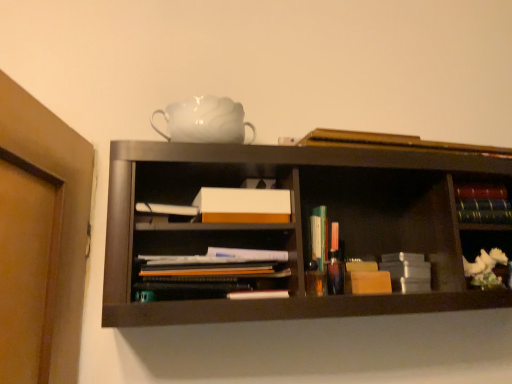
Question: Would you say white ceramic flower at right is to the left or to the right of hardcover books at right, positioned as the 3th book in top-to-bottom order, in the picture?

Choices:
 (A) left
 (B) right

Answer: (A)

Question: From the image's perspective, relative to hardcover books at right, positioned as the 2th book in bottom-to-top order, is white ceramic flower at right above or below?

Choices:
 (A) above
 (B) below

Answer: (B)

Question: Which object is positioned farthest from the white matte box at center?

Choices:
 (A) white ceramic flower at right
 (B) hardcover books at right, positioned as the 3th book in top-to-bottom order
 (C) translucent plastic books at center, the first book in the bottom-to-top sequence
 (D) multicolored hardcover books at right, the 2th book from the top
 (E) matte paper documents at center

Answer: (A)

Question: Considering the real-world distances, which object is farthest from the hardcover book at upper center, the fourth book ordered from the bottom?

Choices:
 (A) white glossy teapot at upper center
 (B) multicolored hardcover books at right, which is the 3th book in bottom-to-top order
 (C) translucent plastic books at center, the first book in the bottom-to-top sequence
 (D) white matte box at center
 (E) white ceramic flower at right

Answer: (E)